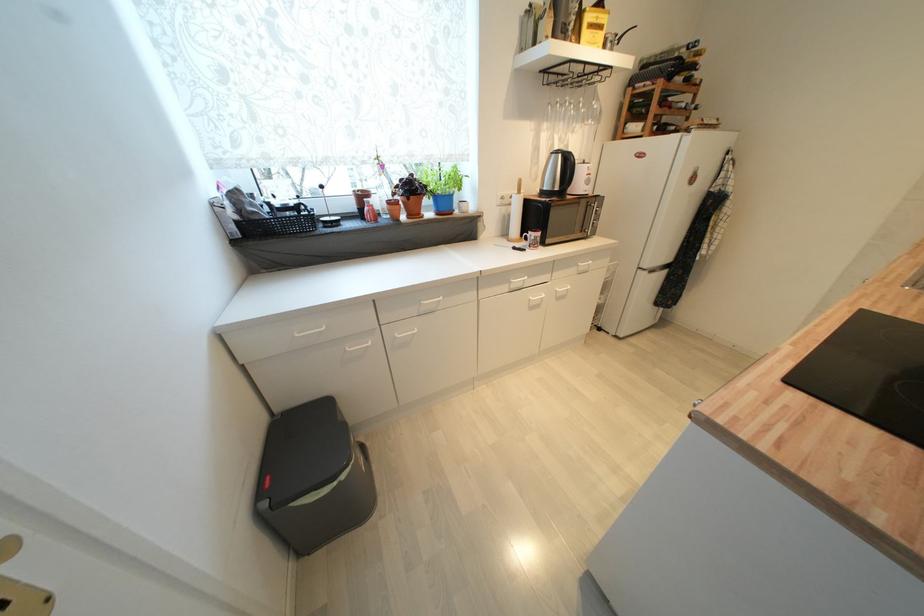
The height and width of the screenshot is (616, 924). Describe the element at coordinates (660, 269) in the screenshot. I see `the refrigerator door handle` at that location.